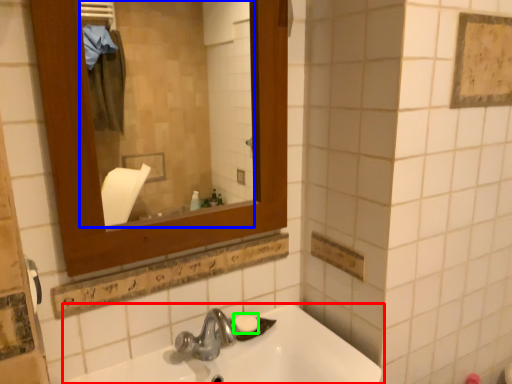
Question: Which is farther away from sink (highlighted by a red box)? mirror (highlighted by a blue box) or soap (highlighted by a green box)?

Choices:
 (A) mirror
 (B) soap

Answer: (A)